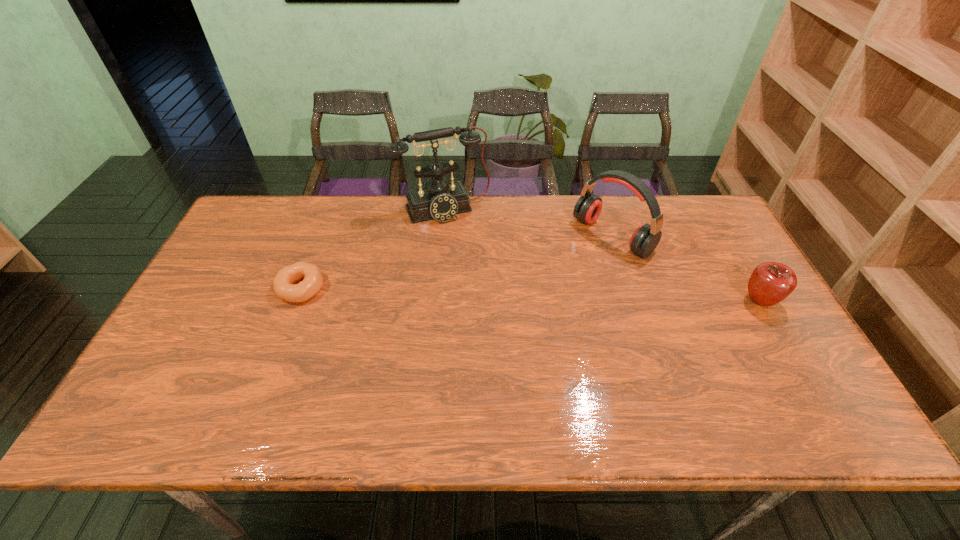
The image size is (960, 540). What are the coordinates of `vacant area that lies between the doughnut and the third shortest object` in the screenshot? It's located at (457, 262).

Identify the location of vacant space in between the second tallest object and the third tallest object. This screenshot has width=960, height=540. (686, 269).

The image size is (960, 540). I want to click on vacant area between the leftmost object and the second shortest object, so click(x=531, y=295).

Image resolution: width=960 pixels, height=540 pixels. Find the location of `free space between the rightmost object and the third object from right to left`. free space between the rightmost object and the third object from right to left is located at coordinates (603, 255).

Identify the location of vacant region between the third shortest object and the shortest object. This screenshot has height=540, width=960. (457, 262).

Point out which object is positioned as the third nearest to the doughnut. Please provide its 2D coordinates. Your answer should be formatted as a tuple, i.e. [(x, y)], where the tuple contains the x and y coordinates of a point satisfying the conditions above.

[(771, 282)]

Select which object is the second closest to the apple. Please provide its 2D coordinates. Your answer should be formatted as a tuple, i.e. [(x, y)], where the tuple contains the x and y coordinates of a point satisfying the conditions above.

[(441, 200)]

This screenshot has height=540, width=960. What are the coordinates of `vacant area that satisfies the following two spatial constraints: 1. on the front side of the shortest object; 2. on the right side of the rightmost object` in the screenshot? It's located at (297, 301).

Locate an element on the screen. free space that satisfies the following two spatial constraints: 1. on the front side of the third tallest object; 2. on the right side of the second tallest object is located at coordinates pyautogui.click(x=634, y=301).

Identify the location of blank space that satisfies the following two spatial constraints: 1. on the back side of the leftmost object; 2. on the right side of the third object from left to right. The image size is (960, 540). pos(322,236).